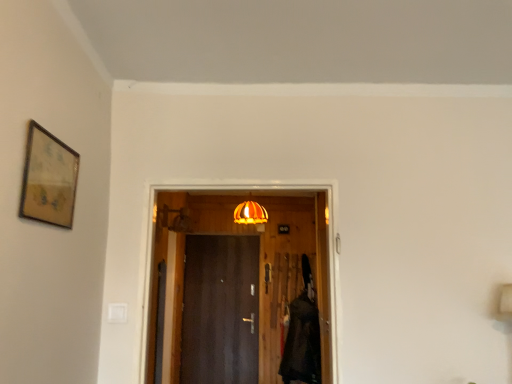
Question: Does dark wood door at center, the first door from the bottom, have a smaller size compared to velvet black robe at right?

Choices:
 (A) yes
 (B) no

Answer: (A)

Question: Considering the relative sizes of dark wood door at center, the first door from the bottom, and velvet black robe at right in the image provided, is dark wood door at center, the first door from the bottom, shorter than velvet black robe at right?

Choices:
 (A) yes
 (B) no

Answer: (B)

Question: Is dark wood door at center, acting as the 1th door starting from the back, far away from velvet black robe at right?

Choices:
 (A) yes
 (B) no

Answer: (B)

Question: Is dark wood door at center, acting as the 1th door starting from the back, wider than velvet black robe at right?

Choices:
 (A) no
 (B) yes

Answer: (A)

Question: From a real-world perspective, is dark wood door at center, the first door from the bottom, located beneath velvet black robe at right?

Choices:
 (A) no
 (B) yes

Answer: (A)

Question: Considering their positions, is wooden-framed artwork at upper left located in front of or behind wooden door at center, the second door from the back?

Choices:
 (A) behind
 (B) front

Answer: (B)

Question: Looking at their shapes, would you say wooden-framed artwork at upper left is wider or thinner than wooden door at center, the second door when ordered from bottom to top?

Choices:
 (A) wide
 (B) thin

Answer: (B)

Question: Based on their sizes in the image, would you say wooden-framed artwork at upper left is bigger or smaller than wooden door at center, the second door when ordered from bottom to top?

Choices:
 (A) small
 (B) big

Answer: (A)

Question: Is wooden-framed artwork at upper left taller or shorter than wooden door at center, which ranks as the first door in top-to-bottom order?

Choices:
 (A) short
 (B) tall

Answer: (A)

Question: From the image's perspective, is dark wood door at center, arranged as the 2th door when viewed from the top, above or below wooden-framed artwork at upper left?

Choices:
 (A) above
 (B) below

Answer: (B)

Question: Visually, is dark wood door at center, the first door from the bottom, positioned to the left or to the right of wooden-framed artwork at upper left?

Choices:
 (A) right
 (B) left

Answer: (A)

Question: In the image, is dark wood door at center, acting as the 1th door starting from the back, positioned in front of or behind wooden-framed artwork at upper left?

Choices:
 (A) front
 (B) behind

Answer: (B)

Question: Considering the positions of point (243, 379) and point (75, 160), is point (243, 379) closer or farther from the camera than point (75, 160)?

Choices:
 (A) closer
 (B) farther

Answer: (B)

Question: Relative to orange glass lampshade at center, is wooden door at center, the second door when ordered from bottom to top, in front or behind?

Choices:
 (A) behind
 (B) front

Answer: (B)

Question: From a real-world perspective, relative to orange glass lampshade at center, is wooden door at center, the second door when ordered from bottom to top, vertically above or below?

Choices:
 (A) above
 (B) below

Answer: (B)